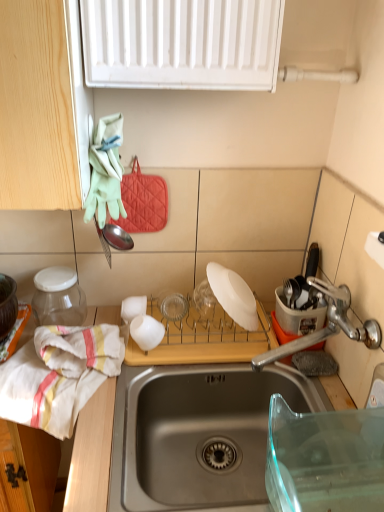
Question: Does white matte cup at center have a smaller size compared to satin nickel faucet at right?

Choices:
 (A) yes
 (B) no

Answer: (A)

Question: Does white matte cup at center appear on the left side of satin nickel faucet at right?

Choices:
 (A) yes
 (B) no

Answer: (A)

Question: Does white matte cup at center have a lesser width compared to satin nickel faucet at right?

Choices:
 (A) no
 (B) yes

Answer: (B)

Question: Is white matte cup at center positioned in front of satin nickel faucet at right?

Choices:
 (A) yes
 (B) no

Answer: (B)

Question: Does white matte cup at center have a greater width compared to satin nickel faucet at right?

Choices:
 (A) yes
 (B) no

Answer: (B)

Question: Is point (240, 302) positioned closer to the camera than point (170, 431)?

Choices:
 (A) farther
 (B) closer

Answer: (B)

Question: In terms of size, does white matte plate at center, arranged as the 1th appliance when viewed from the right, appear bigger or smaller than wooden cutting board at lower center?

Choices:
 (A) small
 (B) big

Answer: (A)

Question: From the image's perspective, is white matte plate at center, arranged as the 1th appliance when viewed from the right, above or below wooden cutting board at lower center?

Choices:
 (A) above
 (B) below

Answer: (A)

Question: Based on their positions, is white matte plate at center, arranged as the 1th appliance when viewed from the right, located to the left or right of wooden cutting board at lower center?

Choices:
 (A) left
 (B) right

Answer: (B)

Question: Is stainless steel sink at center inside or outside of transparent glass jar at left, the 1th appliance when ordered from left to right?

Choices:
 (A) inside
 (B) outside

Answer: (B)

Question: From the image's perspective, is stainless steel sink at center above or below transparent glass jar at left, the 1th appliance when ordered from left to right?

Choices:
 (A) above
 (B) below

Answer: (B)

Question: Relative to transparent glass jar at left, acting as the 3th appliance starting from the right, is stainless steel sink at center in front or behind?

Choices:
 (A) front
 (B) behind

Answer: (A)

Question: Does point (162, 494) appear closer or farther from the camera than point (74, 316)?

Choices:
 (A) farther
 (B) closer

Answer: (B)

Question: From the image's perspective, is white cotton towel at left positioned above or below stainless steel sink at center?

Choices:
 (A) below
 (B) above

Answer: (B)

Question: Is white cotton towel at left situated inside stainless steel sink at center or outside?

Choices:
 (A) outside
 (B) inside

Answer: (A)